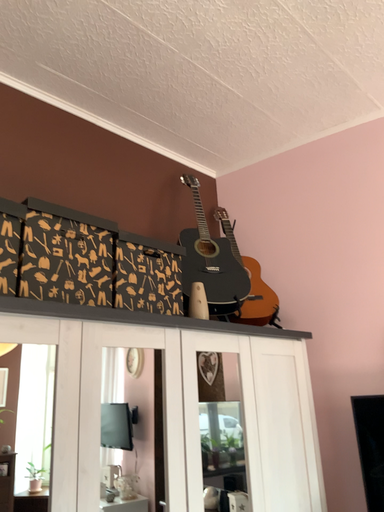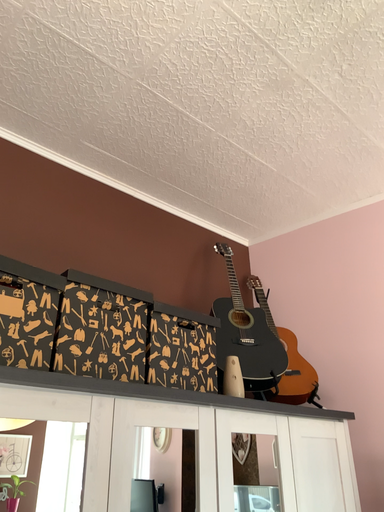
Question: Which way did the camera rotate in the video?

Choices:
 (A) rotated downward
 (B) rotated upward

Answer: (B)